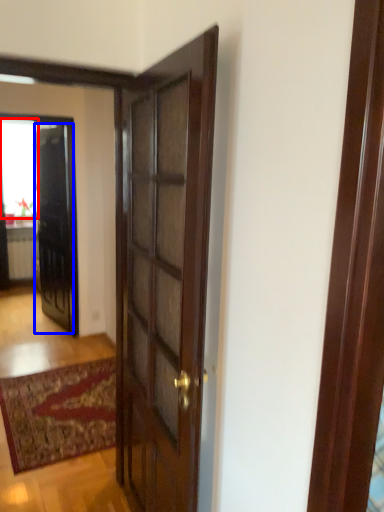
Question: Which object is further to the camera taking this photo, window (highlighted by a red box) or door (highlighted by a blue box)?

Choices:
 (A) window
 (B) door

Answer: (A)